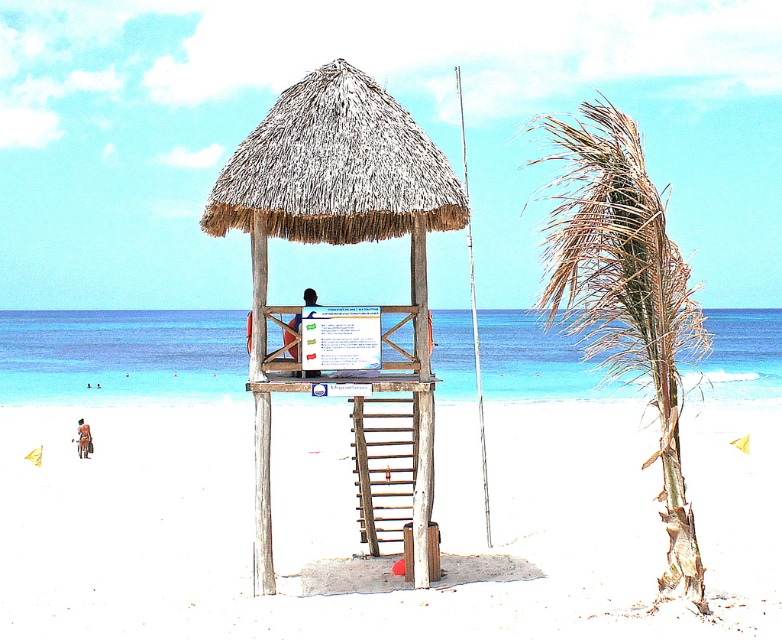
In the scene shown: Which of these two, white sandy beach at center or thatched wood hut at center, stands taller?

Standing taller between the two is thatched wood hut at center.

In the scene shown: Between white sandy beach at center and thatched wood hut at center, which one is positioned higher?

thatched wood hut at center is above.

Does point (576, 573) come farther from viewer compared to point (275, 141)?

Yes, it is behind point (275, 141).

Where is `white sandy beach at center`? white sandy beach at center is located at coordinates (357, 525).

Who is positioned more to the right, wooden at center or brown leather bag at center?

wooden at center

Is wooden at center closer to camera compared to brown leather bag at center?

That is True.

Is point (393, 532) closer to camera compared to point (85, 436)?

Yes.

The image size is (782, 640). Identify the location of wooden at center. (382, 467).

Which is behind, point (253, 364) or point (291, 337)?

Point (291, 337)

Which is more to the right, wooden pole at center or blue fabric shirt at center?

From the viewer's perspective, wooden pole at center appears more on the right side.

Between point (259, 460) and point (307, 292), which one is positioned behind?

The point (307, 292) is more distant.

You are a GUI agent. You are given a task and a screenshot of the screen. Output one action in this format:
    pyautogui.click(x=<x>, y=<y>)
    Task: Click on the wooden pole at center
    Image resolution: width=782 pixels, height=640 pixels.
    Given the screenshot: What is the action you would take?
    pyautogui.click(x=260, y=412)